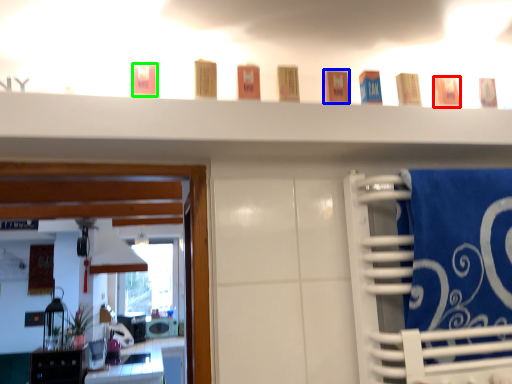
Question: Which is farther away from toiletry (highlighted by a red box)? toiletry (highlighted by a blue box) or toiletry (highlighted by a green box)?

Choices:
 (A) toiletry
 (B) toiletry

Answer: (B)